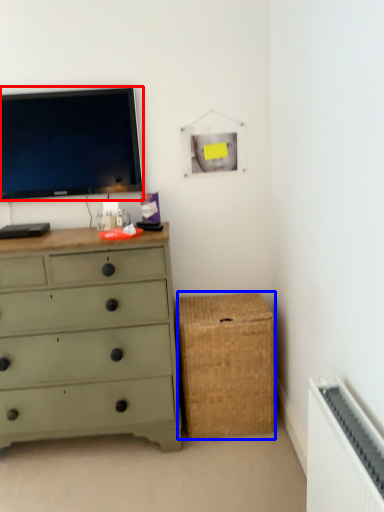
Question: Which point is further to the camera, television (highlighted by a red box) or storage box (highlighted by a blue box)?

Choices:
 (A) television
 (B) storage box

Answer: (B)